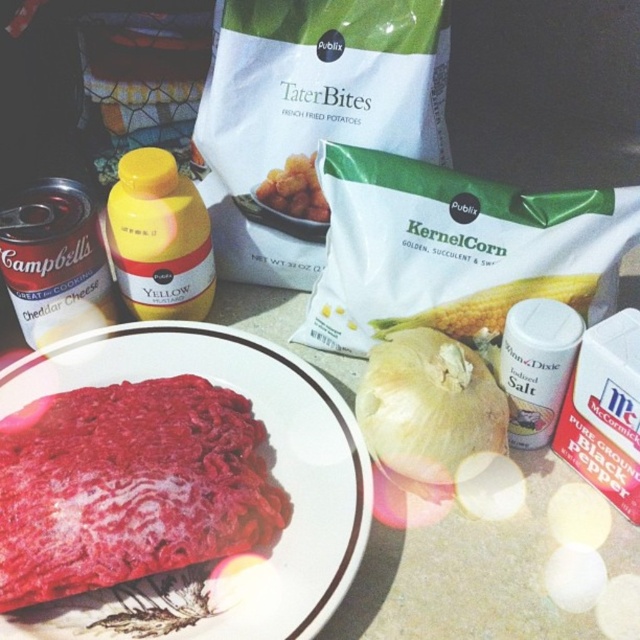
Where is the white matte onion at center located in terms of coordinates?

The white matte onion at center is located at coordinates point (x=428, y=404).

You are a chef arranging ingredients on a counter. You have a white matte onion at center and a white matte corn at center. Where should you place a new ingredient to the right of both?

The white matte corn at center is to the right of the white matte onion at center. To place the new ingredient to the right of both, position it to the right of the white matte corn at center.